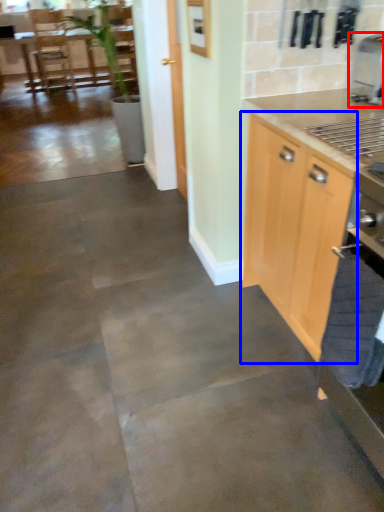
Question: Which of the following is the closest to the observer, coffee machine (highlighted by a red box) or cabinetry (highlighted by a blue box)?

Choices:
 (A) coffee machine
 (B) cabinetry

Answer: (B)